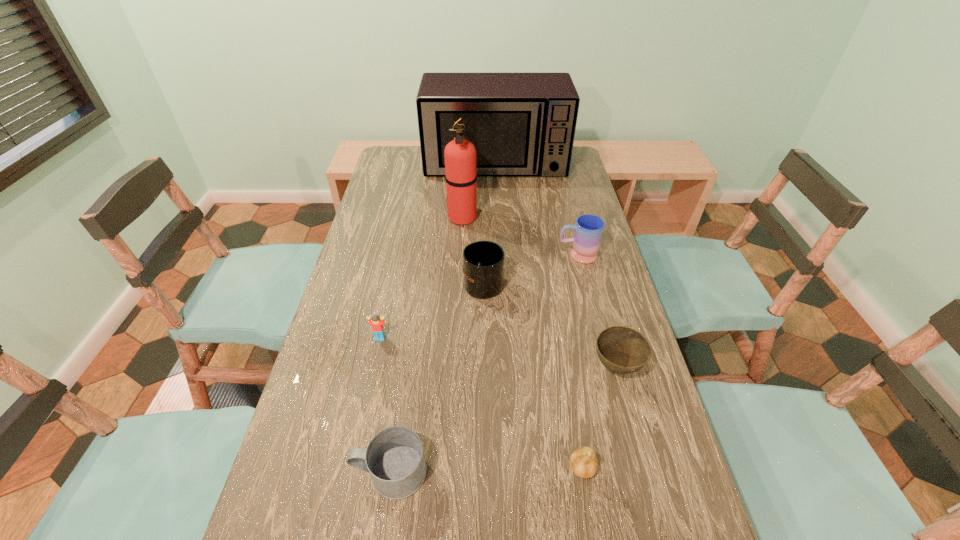
You are a GUI agent. You are given a task and a screenshot of the screen. Output one action in this format:
    pyautogui.click(x=<x>, y=<y>)
    Task: Click on the bowl
    The image size is (960, 540).
    Given the screenshot: What is the action you would take?
    pyautogui.click(x=622, y=350)

Locate an element on the screen. This screenshot has height=540, width=960. the fifth farthest object is located at coordinates (377, 325).

At what (x,y) coordinates should I click in order to perform the action: click on vacant space located 0.080m at the nozzle of the second farthest object. Please return your answer as a coordinate pair (x, y). The height and width of the screenshot is (540, 960). Looking at the image, I should click on tap(500, 217).

Locate an element on the screen. Image resolution: width=960 pixels, height=540 pixels. free point located on the front-facing side of the second tallest object is located at coordinates [x=496, y=193].

Identify the location of vacant space located 0.370m on the side of the farthest mug with the handle. The image size is (960, 540). (439, 255).

The image size is (960, 540). Find the location of `blank space located on the side of the farthest mug with the handle`. blank space located on the side of the farthest mug with the handle is located at coordinates (506, 255).

At what (x,y) coordinates should I click in order to perform the action: click on vacant space situated 0.200m on the side of the farthest mug with the handle. Please return your answer as a coordinate pair (x, y). The image size is (960, 540). Looking at the image, I should click on (493, 255).

The image size is (960, 540). What are the coordinates of `free space located with the handle on the side of the second mug from right to left` in the screenshot? It's located at (483, 242).

I want to click on vacant region located 0.220m with the handle on the side of the second mug from right to left, so click(x=483, y=222).

Locate an element on the screen. Image resolution: width=960 pixels, height=540 pixels. vacant space located 0.300m with the handle on the side of the second mug from right to left is located at coordinates (483, 209).